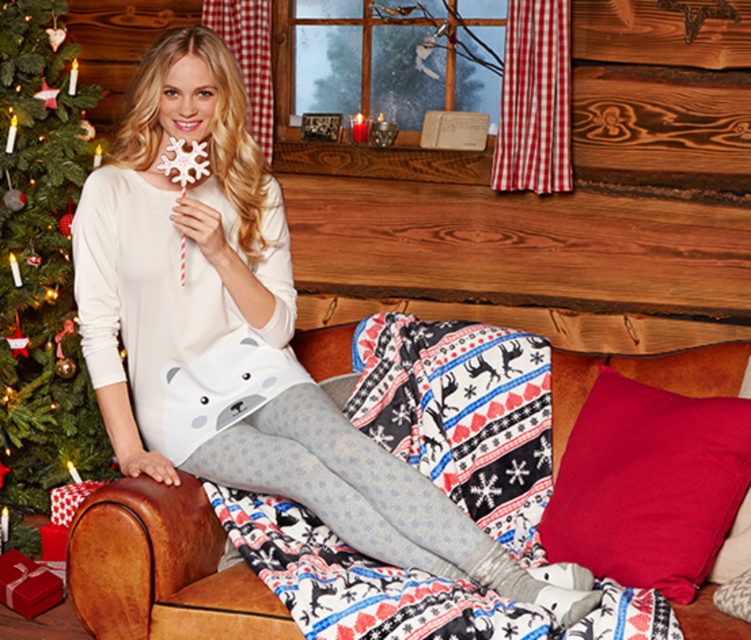
Question: Does red soft pillow at lower right appear under white fabric bear at center?

Choices:
 (A) no
 (B) yes

Answer: (B)

Question: Which object appears farthest from the camera in this image?

Choices:
 (A) red soft pillow at lower right
 (B) white fabric bear at center
 (C) green matte christmas tree at left
 (D) matte white pajama set at center

Answer: (C)

Question: Does green matte christmas tree at left appear on the left side of red soft pillow at lower right?

Choices:
 (A) yes
 (B) no

Answer: (A)

Question: Which of the following is the farthest from the observer?

Choices:
 (A) brown leather couch at center
 (B) green matte christmas tree at left

Answer: (B)

Question: Which object is closer to the camera taking this photo?

Choices:
 (A) velvety red cushion at lower right
 (B) matte white pajama set at center
 (C) white fabric bear at center

Answer: (B)

Question: Does green matte christmas tree at left appear over light gray fleece tights at center?

Choices:
 (A) no
 (B) yes

Answer: (B)